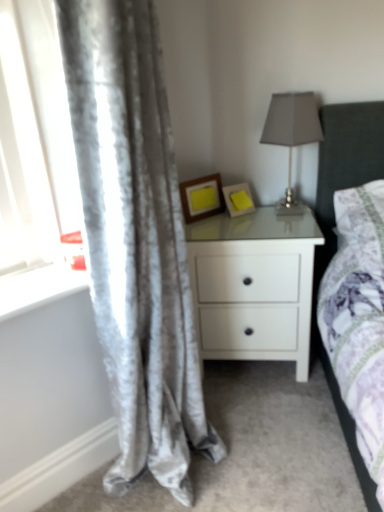
This screenshot has height=512, width=384. What do you see at coordinates (292, 133) in the screenshot?
I see `satin gray lampshade at upper right` at bounding box center [292, 133].

Measure the distance between point (108, 223) and camera.

Point (108, 223) and camera are 38.31 inches apart from each other.

Locate an element on the screen. Image resolution: width=384 pixels, height=512 pixels. yellow matte picture frame at center, placed as the 2th picture frame when sorted from right to left is located at coordinates (202, 197).

From a real-world perspective, relative to yellow matte picture frame at upper center, which ranks as the first picture frame in right-to-left order, is satin gray lampshade at upper right vertically above or below?

satin gray lampshade at upper right is above yellow matte picture frame at upper center, which ranks as the first picture frame in right-to-left order.

Which object is closer to the camera, satin gray lampshade at upper right or yellow matte picture frame at upper center, placed as the second picture frame when sorted from left to right?

satin gray lampshade at upper right is more forward.

Which point is more distant from viewer, (273, 110) or (236, 194)?

The point (236, 194) is farther from the camera.

From the picture: Which is in front, yellow matte picture frame at upper center, placed as the second picture frame when sorted from left to right, or silvery velvet curtains at left?

silvery velvet curtains at left is more forward.

Where is `curtain that appears in front of the yellow matte picture frame at upper center, placed as the second picture frame when sorted from left to right`? The image size is (384, 512). curtain that appears in front of the yellow matte picture frame at upper center, placed as the second picture frame when sorted from left to right is located at coordinates (136, 241).

Is yellow matte picture frame at upper center, placed as the second picture frame when sorted from left to right, wider or thinner than silvery velvet curtains at left?

Considering their sizes, yellow matte picture frame at upper center, placed as the second picture frame when sorted from left to right, looks slimmer than silvery velvet curtains at left.

Based on the photo, considering the relative sizes of yellow matte picture frame at upper center, placed as the second picture frame when sorted from left to right, and silvery velvet curtains at left in the image provided, is yellow matte picture frame at upper center, placed as the second picture frame when sorted from left to right, shorter than silvery velvet curtains at left?

Correct, yellow matte picture frame at upper center, placed as the second picture frame when sorted from left to right, is not as tall as silvery velvet curtains at left.

Looking at this image, from the image's perspective, is satin gray lampshade at upper right over white glossy window sill at lower left?

Yes, from the image's perspective, satin gray lampshade at upper right is over white glossy window sill at lower left.

Could you tell me if satin gray lampshade at upper right is facing white glossy window sill at lower left?

No, satin gray lampshade at upper right is not turned towards white glossy window sill at lower left.

Considering the sizes of objects satin gray lampshade at upper right and white glossy window sill at lower left in the image provided, who is bigger, satin gray lampshade at upper right or white glossy window sill at lower left?

Bigger between the two is satin gray lampshade at upper right.

Considering the points (193, 188) and (141, 60), which point is behind, point (193, 188) or point (141, 60)?

The point (193, 188) is farther.

Can you confirm if yellow matte picture frame at center, which is counted as the first picture frame, starting from the left, is shorter than silvery velvet curtains at left?

Yes.

From the image's perspective, which object appears higher, yellow matte picture frame at center, placed as the 2th picture frame when sorted from right to left, or silvery velvet curtains at left?

From the image's view, yellow matte picture frame at center, placed as the 2th picture frame when sorted from right to left, is above.

Is yellow matte picture frame at center, placed as the 2th picture frame when sorted from right to left, wider or thinner than silvery velvet curtains at left?

yellow matte picture frame at center, placed as the 2th picture frame when sorted from right to left, is thinner than silvery velvet curtains at left.

Locate an element on the screen. Image resolution: width=384 pixels, height=512 pixels. window sill located in front of the white glossy nightstand at center is located at coordinates (38, 287).

From a real-world perspective, which object rests below the other?

In real-world perspective, white glossy nightstand at center is lower.

Which object is positioned more to the left, white glossy nightstand at center or white glossy window sill at lower left?

Positioned to the left is white glossy window sill at lower left.

Does white glossy nightstand at center have a greater width compared to white glossy window sill at lower left?

Yes.

Does yellow matte picture frame at center, placed as the 2th picture frame when sorted from right to left, have a smaller size compared to white glossy window sill at lower left?

No, yellow matte picture frame at center, placed as the 2th picture frame when sorted from right to left, is not smaller than white glossy window sill at lower left.

How much distance is there between yellow matte picture frame at center, which is counted as the first picture frame, starting from the left, and white glossy window sill at lower left?

27.72 inches.

In terms of height, does yellow matte picture frame at center, placed as the 2th picture frame when sorted from right to left, look taller or shorter compared to white glossy window sill at lower left?

Considering their sizes, yellow matte picture frame at center, placed as the 2th picture frame when sorted from right to left, has more height than white glossy window sill at lower left.

Which point is more forward, [197,202] or [18,305]?

The point [18,305] is more forward.

Is white glossy nightstand at center thinner than satin gray lampshade at upper right?

No.

From the image's perspective, is white glossy nightstand at center above or below satin gray lampshade at upper right?

white glossy nightstand at center is below satin gray lampshade at upper right.

Considering the sizes of white glossy nightstand at center and satin gray lampshade at upper right in the image, is white glossy nightstand at center bigger or smaller than satin gray lampshade at upper right?

Clearly, white glossy nightstand at center is larger in size than satin gray lampshade at upper right.

Who is taller, white glossy nightstand at center or satin gray lampshade at upper right?

Standing taller between the two is white glossy nightstand at center.

From the image's perspective, count 2nd picture frames downward from the satin gray lampshade at upper right and point to it. Please provide its 2D coordinates.

[(238, 199)]

Where is `picture frame below the silvery velvet curtains at left (from a real-world perspective)`? Image resolution: width=384 pixels, height=512 pixels. picture frame below the silvery velvet curtains at left (from a real-world perspective) is located at coordinates (238, 199).

Considering their positions, is satin gray lampshade at upper right positioned closer to white glossy window sill at lower left than silvery velvet curtains at left?

silvery velvet curtains at left is positioned closer to the anchor white glossy window sill at lower left.

Consider the image. Based on their spatial positions, is silvery velvet curtains at left or white glossy nightstand at center closer to satin gray lampshade at upper right?

The object closer to satin gray lampshade at upper right is white glossy nightstand at center.

In the scene shown: When comparing their distances from yellow matte picture frame at upper center, which ranks as the first picture frame in right-to-left order, does white glossy window sill at lower left or satin gray lampshade at upper right seem closer?

Among the two, satin gray lampshade at upper right is located nearer to yellow matte picture frame at upper center, which ranks as the first picture frame in right-to-left order.

Considering their positions, is yellow matte picture frame at center, placed as the 2th picture frame when sorted from right to left, positioned closer to yellow matte picture frame at upper center, which ranks as the first picture frame in right-to-left order, than white glossy window sill at lower left?

Among the two, yellow matte picture frame at center, placed as the 2th picture frame when sorted from right to left, is located nearer to yellow matte picture frame at upper center, which ranks as the first picture frame in right-to-left order.

Looking at the image, which one is located closer to yellow matte picture frame at upper center, placed as the second picture frame when sorted from left to right, silvery velvet curtains at left or white glossy window sill at lower left?

silvery velvet curtains at left is closer to yellow matte picture frame at upper center, placed as the second picture frame when sorted from left to right.

Which object lies further to the anchor point yellow matte picture frame at upper center, placed as the second picture frame when sorted from left to right, satin gray lampshade at upper right or white glossy nightstand at center?

Based on the image, white glossy nightstand at center appears to be further to yellow matte picture frame at upper center, placed as the second picture frame when sorted from left to right.

When comparing their distances from silvery velvet curtains at left, does yellow matte picture frame at upper center, which ranks as the first picture frame in right-to-left order, or white glossy nightstand at center seem closer?

The object closer to silvery velvet curtains at left is white glossy nightstand at center.

From the image, which object appears to be farther from yellow matte picture frame at center, which is counted as the first picture frame, starting from the left, white glossy window sill at lower left or white glossy nightstand at center?

white glossy window sill at lower left.

Find the location of a particular element. The image size is (384, 512). table lamp between silvery velvet curtains at left and yellow matte picture frame at center, which is counted as the first picture frame, starting from the left, along the z-axis is located at coordinates (292, 133).

The height and width of the screenshot is (512, 384). In order to click on curtain between white glossy window sill at lower left and satin gray lampshade at upper right in the horizontal direction in this screenshot , I will do `click(136, 241)`.

Locate an element on the screen. The image size is (384, 512). window sill between silvery velvet curtains at left and yellow matte picture frame at upper center, which ranks as the first picture frame in right-to-left order, along the z-axis is located at coordinates (38, 287).

Identify the location of table lamp between silvery velvet curtains at left and white glossy nightstand at center along the z-axis. (292, 133).